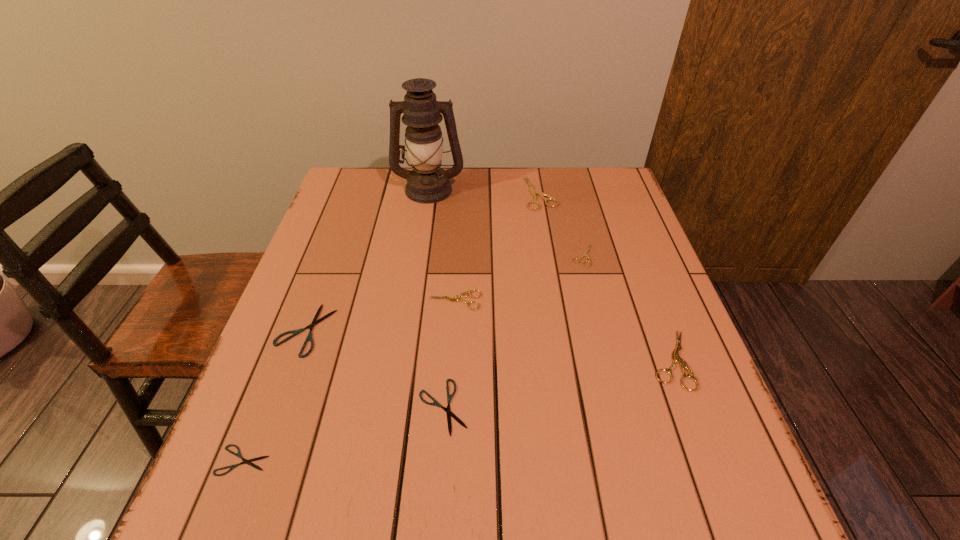
The image size is (960, 540). In the image, there is a desktop. Find the location of `vacant space at the far right corner`. vacant space at the far right corner is located at coordinates (620, 198).

The width and height of the screenshot is (960, 540). What are the coordinates of `free location at the near right corner of the desktop` in the screenshot? It's located at (757, 538).

You are a GUI agent. You are given a task and a screenshot of the screen. Output one action in this format:
    pyautogui.click(x=<x>, y=<y>)
    Task: Click on the vacant area that lies between the smallest black shears and the farthest beige shears
    The width and height of the screenshot is (960, 540).
    Given the screenshot: What is the action you would take?
    pyautogui.click(x=392, y=327)

You are a GUI agent. You are given a task and a screenshot of the screen. Output one action in this format:
    pyautogui.click(x=<x>, y=<y>)
    Task: Click on the vacant region between the third nearest beige shears and the third object from right to left
    This screenshot has height=540, width=960.
    Given the screenshot: What is the action you would take?
    pyautogui.click(x=562, y=225)

Image resolution: width=960 pixels, height=540 pixels. Find the location of `free area in between the shortest object and the farthest shears`. free area in between the shortest object and the farthest shears is located at coordinates (392, 327).

This screenshot has height=540, width=960. What are the coordinates of `free space between the rightmost black shears and the third smallest beige shears` in the screenshot? It's located at (557, 383).

What are the coordinates of `vacant area between the rightmost black shears and the second tallest shears` in the screenshot? It's located at (557, 383).

Locate an element on the screen. The image size is (960, 540). vacant space that is in between the biggest black shears and the third tallest object is located at coordinates (489, 345).

The width and height of the screenshot is (960, 540). Identify the location of vacant space that's between the second biggest beige shears and the farthest black shears. (489, 345).

The width and height of the screenshot is (960, 540). Identify the location of vacant space in between the biggest black shears and the fourth tallest object. (380, 315).